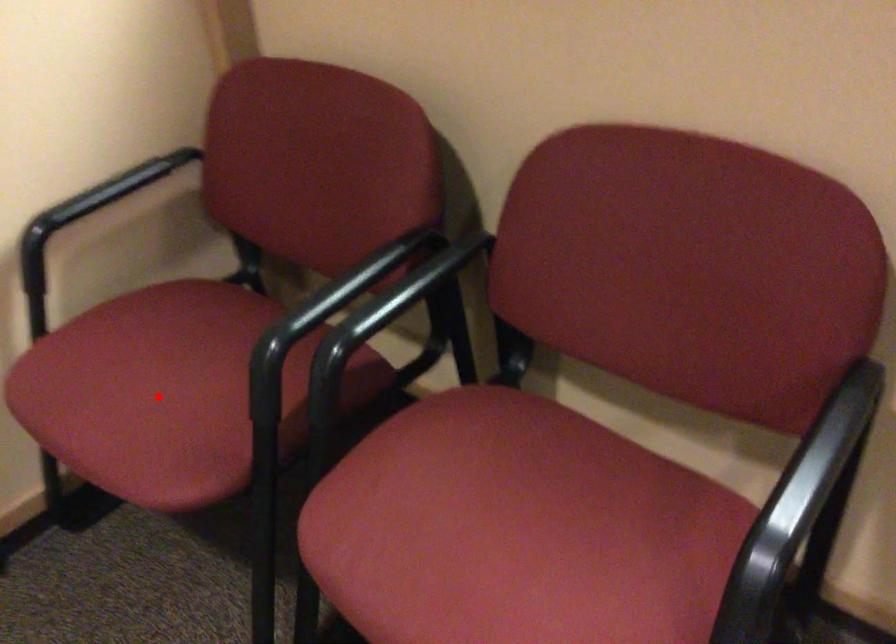
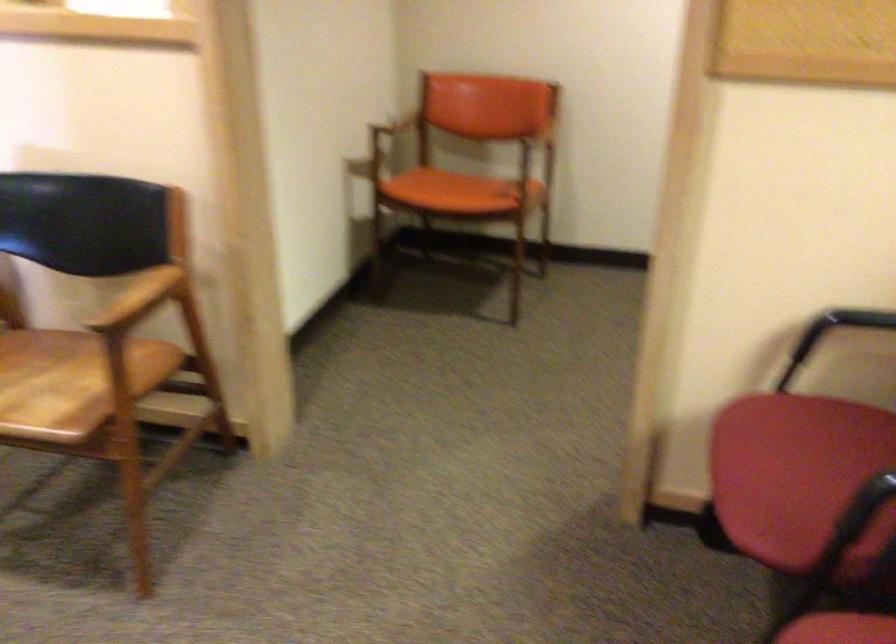
In the second image, find the point that corresponds to the highlighted location in the first image.

(798, 477)